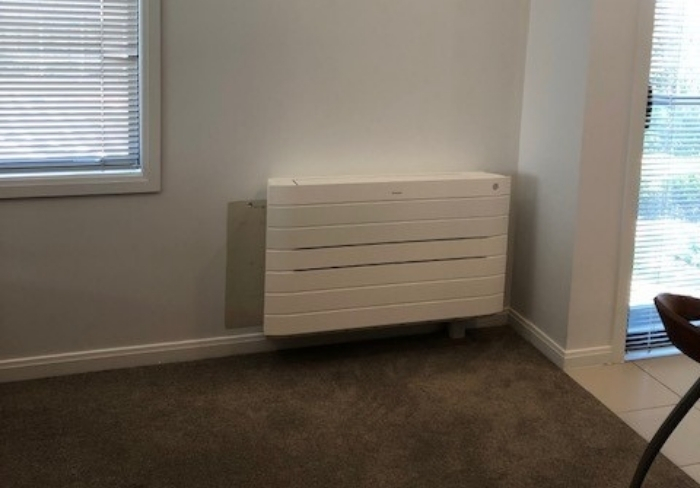
Locate an element on the screen. This screenshot has height=488, width=700. wall is located at coordinates (337, 104).